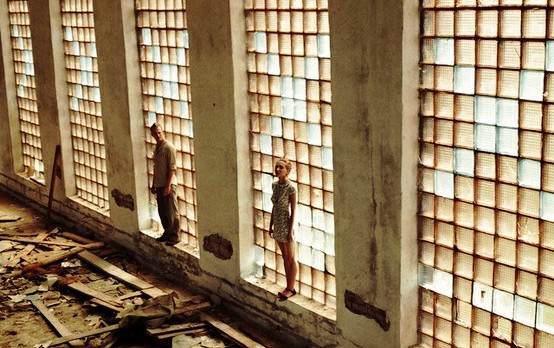
The height and width of the screenshot is (348, 554). I want to click on clear pane, so click(x=446, y=181).